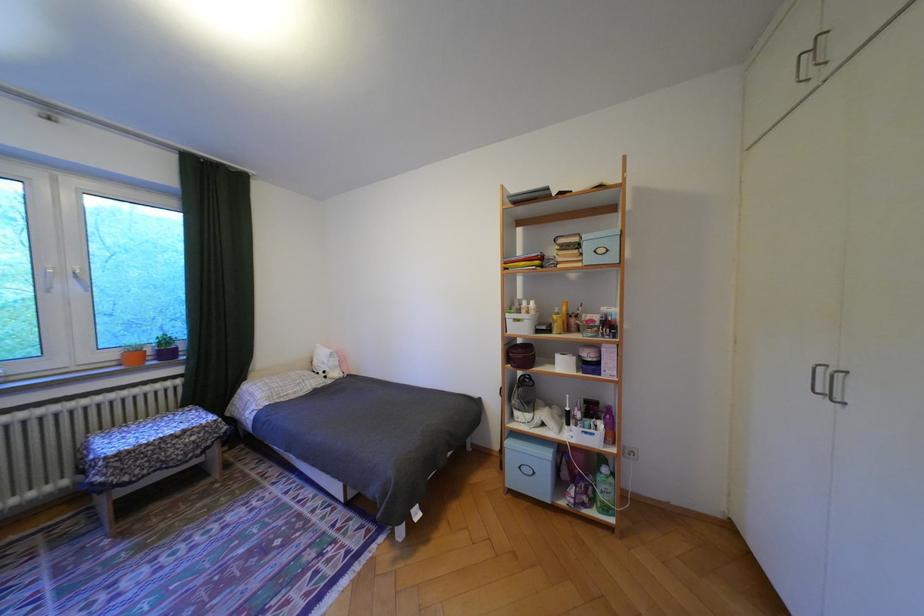
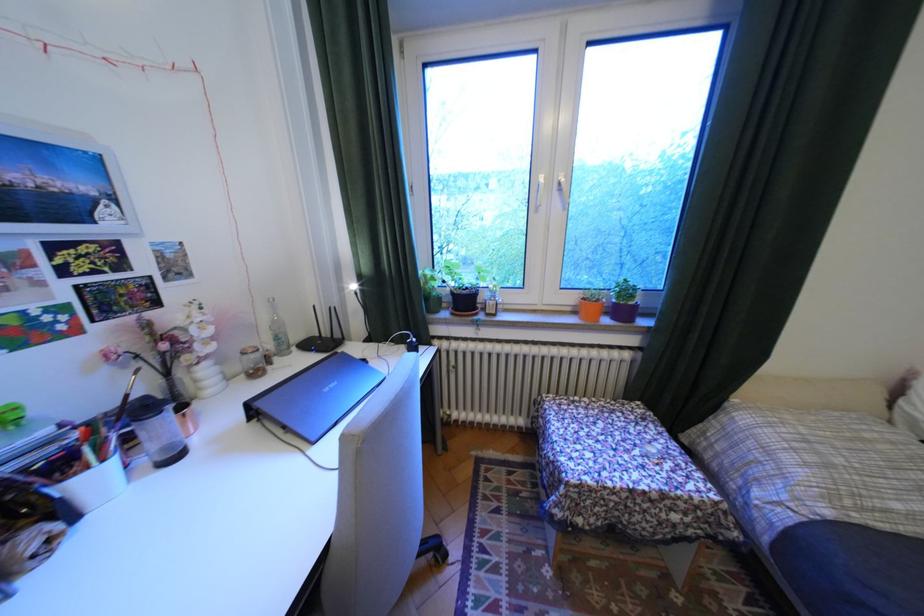
Find the pixel in the second image that matches point (126, 363) in the first image.

(580, 309)